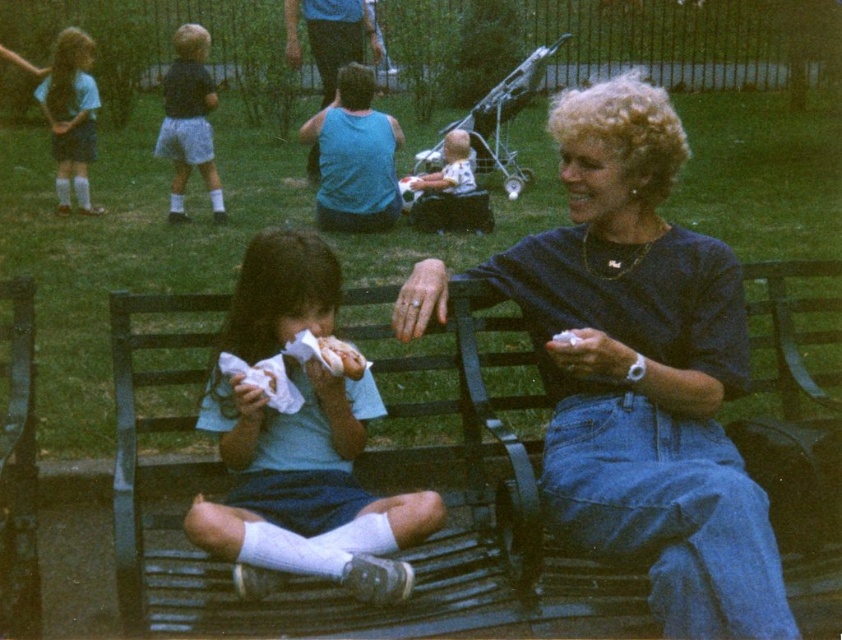
Which of these two, matte blue shorts at upper left or matte blue shorts at left, stands taller?

matte blue shorts at left

From the picture: Does matte blue shorts at upper left have a lesser height compared to matte blue shorts at left?

Yes, matte blue shorts at upper left is shorter than matte blue shorts at left.

The height and width of the screenshot is (640, 842). What do you see at coordinates (188, 122) in the screenshot? I see `matte blue shorts at upper left` at bounding box center [188, 122].

Where is `matte blue shorts at upper left`? matte blue shorts at upper left is located at coordinates (188, 122).

Can you confirm if dark blue shirt at center is wider than matte blue shorts at upper left?

Yes.

Is dark blue shirt at center closer to the viewer compared to matte blue shorts at upper left?

Yes, dark blue shirt at center is in front of matte blue shorts at upper left.

This screenshot has height=640, width=842. In order to click on dark blue shirt at center in this screenshot , I will do click(643, 371).

Is white cotton shirt at center closer to the viewer compared to matte blue shorts at upper left?

Yes, it is.

Between point (275, 260) and point (193, 72), which one is positioned in front?

Positioned in front is point (275, 260).

Does point (398, 589) lie in front of point (180, 145)?

Yes, point (398, 589) is closer to viewer.

This screenshot has width=842, height=640. Identify the location of white cotton shirt at center. (305, 486).